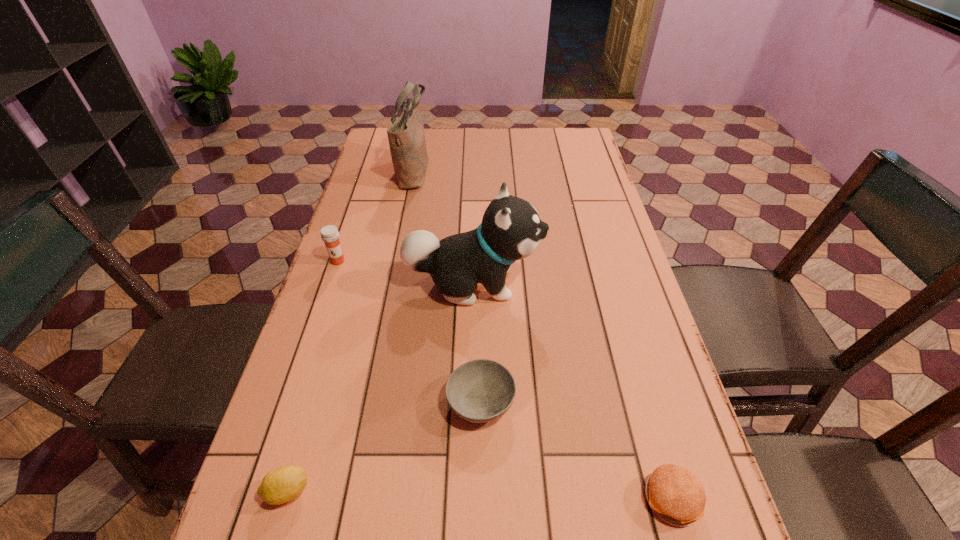
Where is `vacant area located on the left of the hamburger`? This screenshot has height=540, width=960. vacant area located on the left of the hamburger is located at coordinates (498, 498).

Locate an element on the screen. Image resolution: width=960 pixels, height=540 pixels. blank space located 0.160m on the right of the third nearest object is located at coordinates (594, 401).

This screenshot has height=540, width=960. I want to click on object at the far edge, so click(x=406, y=136).

Locate an element on the screen. The width and height of the screenshot is (960, 540). shoulder bag present at the left edge is located at coordinates (406, 136).

Where is `medicine positioned at the left edge`? The width and height of the screenshot is (960, 540). medicine positioned at the left edge is located at coordinates (329, 234).

Where is `lemon situated at the left edge`? The height and width of the screenshot is (540, 960). lemon situated at the left edge is located at coordinates (283, 484).

Where is `object located at the right edge`? object located at the right edge is located at coordinates pos(676,495).

Image resolution: width=960 pixels, height=540 pixels. Find the location of `object that is at the far left corner`. object that is at the far left corner is located at coordinates (406, 136).

Locate an element on the screen. This screenshot has width=960, height=540. vacant space at the far edge is located at coordinates (440, 152).

In the image, there is a desktop. What are the coordinates of `vacant area at the left edge` in the screenshot? It's located at (x=321, y=409).